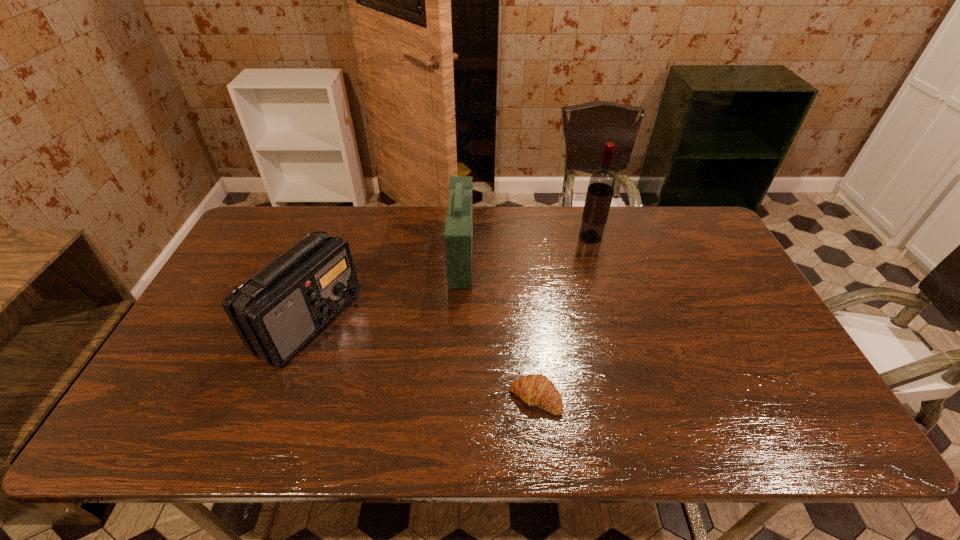
This screenshot has height=540, width=960. In order to click on wine bottle in this screenshot , I will do `click(601, 186)`.

Locate an element on the screen. The image size is (960, 540). the tallest object is located at coordinates (601, 186).

Find the location of a particular element. The image size is (960, 540). the first-aid kit is located at coordinates (458, 235).

Find the location of `the leftmost object`. the leftmost object is located at coordinates (277, 311).

Identify the location of the nearest object. (536, 390).

This screenshot has height=540, width=960. Find the location of `crescent roll`. crescent roll is located at coordinates (536, 390).

The height and width of the screenshot is (540, 960). Identify the location of free space located 0.190m on the front of the tallest object. (604, 286).

This screenshot has width=960, height=540. I want to click on vacant space located on the front-facing side of the first-aid kit, so click(x=569, y=256).

The height and width of the screenshot is (540, 960). In order to click on free space located 0.110m on the front panel of the radio receiver in this screenshot , I will do `click(394, 321)`.

I want to click on free spot located 0.120m on the right of the nearest object, so click(612, 398).